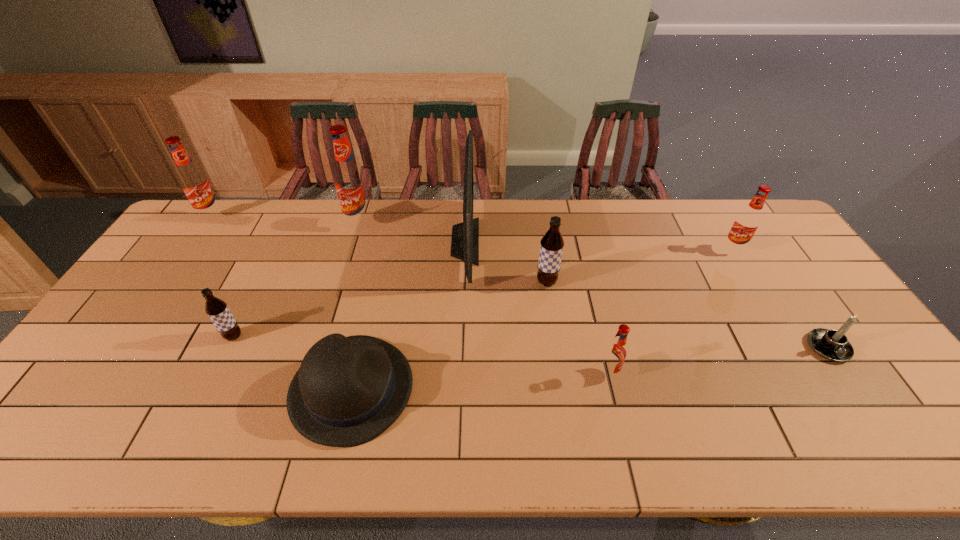
Where is `free space located 0.110m on the left of the second nearest red root beer`? Image resolution: width=960 pixels, height=540 pixels. free space located 0.110m on the left of the second nearest red root beer is located at coordinates (689, 249).

Image resolution: width=960 pixels, height=540 pixels. I want to click on vacant area located on the front of the seventh object from left to right, so click(623, 431).

This screenshot has width=960, height=540. Identify the location of vacant space located on the back of the second root beer from left to right. (266, 271).

Locate an element on the screen. This screenshot has width=960, height=540. vacant space located 0.370m on the front-facing side of the bowler hat is located at coordinates (564, 389).

You are a GUI agent. You are given a task and a screenshot of the screen. Output one action in this format:
    pyautogui.click(x=<x>, y=<y>)
    Task: Click on the free space located 0.090m with a handle on the side of the candle holder
    Image resolution: width=960 pixels, height=540 pixels.
    Given the screenshot: What is the action you would take?
    pyautogui.click(x=861, y=396)

The width and height of the screenshot is (960, 540). Find the location of `monitor that is at the far edge`. monitor that is at the far edge is located at coordinates (465, 236).

Locate an element on the screen. object present at the near edge is located at coordinates (348, 390).

You are a GUI agent. You are given a task and a screenshot of the screen. Output one action in this format:
    pyautogui.click(x=<x>, y=<y>)
    Task: Click on the object located in the left edge section of the desktop
    This screenshot has width=960, height=540.
    Given the screenshot: What is the action you would take?
    pyautogui.click(x=195, y=184)

Locate an element on the screen. root beer located at the right edge is located at coordinates (747, 222).

At what (x,y) coordinates should I click in order to perform the action: click on candle holder that is at the right edge. Please return your answer as a coordinate pair (x, y). The image size is (960, 540). Looking at the image, I should click on (833, 345).